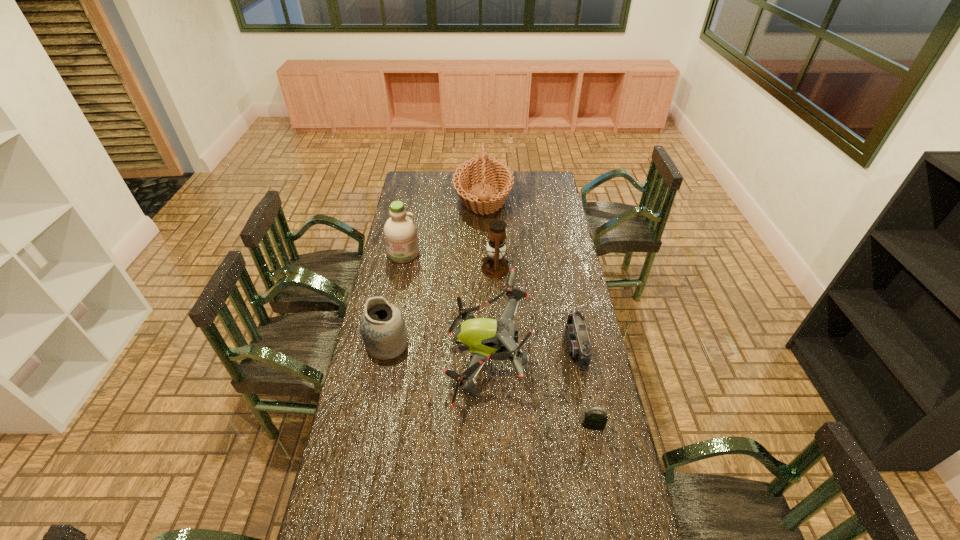
Where is `object situated at the far edge`? This screenshot has width=960, height=540. object situated at the far edge is located at coordinates (485, 170).

Locate an element on the screen. The width and height of the screenshot is (960, 540). cleansing agent positioned at the left edge is located at coordinates (400, 232).

Find the location of a particular element. pottery situated at the left edge is located at coordinates (382, 325).

Where is `padlock that is at the right edge`? padlock that is at the right edge is located at coordinates (593, 421).

Where is `camcorder that is positioned at the right edge`? camcorder that is positioned at the right edge is located at coordinates (578, 343).

Where is `vacant region at the far edge`? The width and height of the screenshot is (960, 540). vacant region at the far edge is located at coordinates (515, 176).

Image resolution: width=960 pixels, height=540 pixels. Identify the location of vacant position at the left edge of the desktop. (378, 292).

What are the coordinates of `free point at the right edge` in the screenshot? It's located at (594, 535).

Locate an element on the screen. The height and width of the screenshot is (540, 960). free space at the far left corner of the desktop is located at coordinates (422, 188).

Locate an element on the screen. Image resolution: width=960 pixels, height=540 pixels. free space between the nearest object and the lantern is located at coordinates (544, 347).